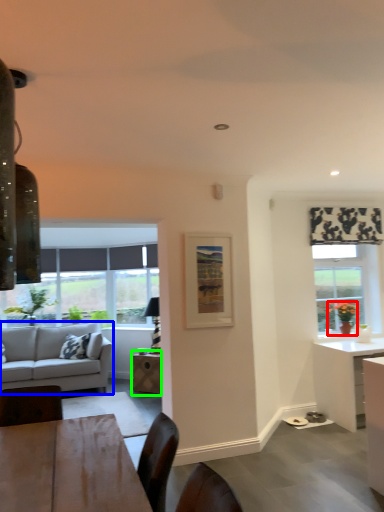
Question: Based on their relative distances, which object is nearer to houseplant (highlighted by a red box)? Choose from studio couch (highlighted by a blue box) and table (highlighted by a green box).

Choices:
 (A) studio couch
 (B) table

Answer: (B)